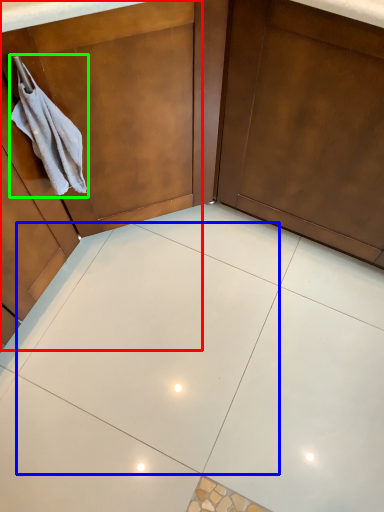
Question: Which is nearer to the dresser (highlighted by a red box)? ceramic tile (highlighted by a blue box) or hand towel (highlighted by a green box).

Choices:
 (A) ceramic tile
 (B) hand towel

Answer: (B)